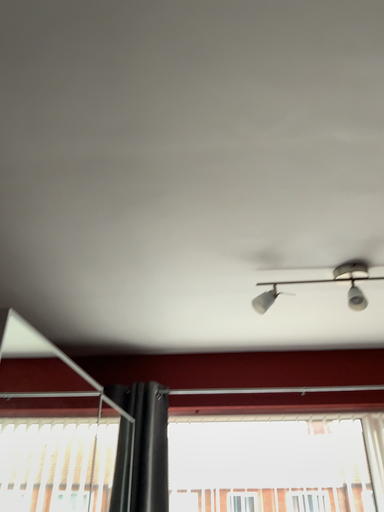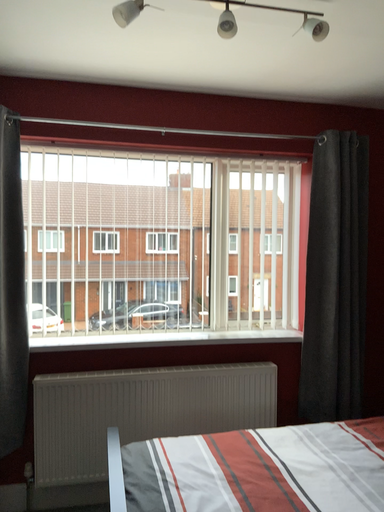
Question: How did the camera likely rotate when shooting the video?

Choices:
 (A) rotated right
 (B) rotated left

Answer: (A)